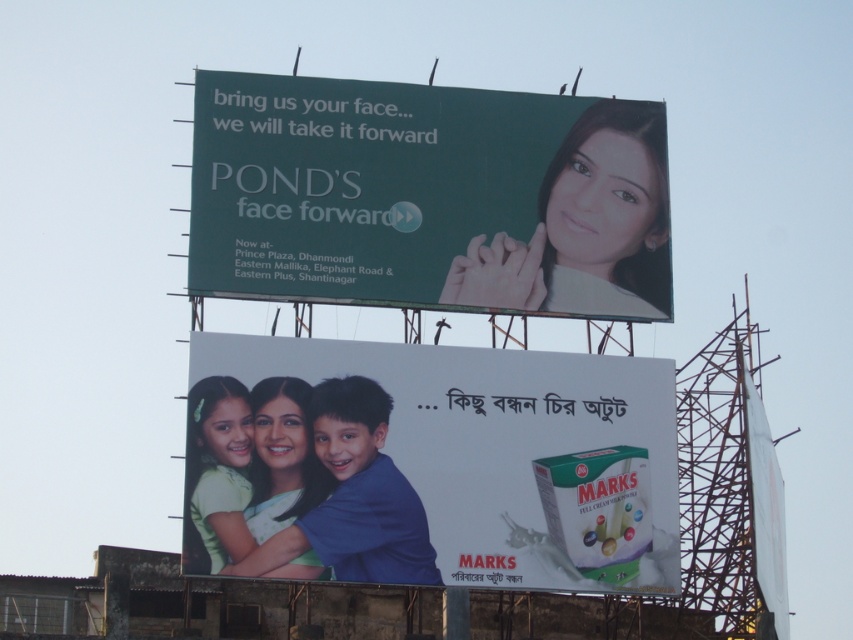
Between point (491, 272) and point (190, 499), which one is positioned behind?

The point (491, 272) is more distant.

Consider the image. Which is below, smooth skin face at upper right or matte white face at center?

Positioned lower is matte white face at center.

Find the location of a particular element. This screenshot has height=640, width=853. smooth skin face at upper right is located at coordinates (584, 227).

Does white cardboard box at center have a greater width compared to smooth skin face at upper right?

Yes, white cardboard box at center is wider than smooth skin face at upper right.

Which of these two, white cardboard box at center or smooth skin face at upper right, stands taller?

white cardboard box at center

Does point (395, 513) lie behind point (641, 131)?

No, it is in front of (641, 131).

The width and height of the screenshot is (853, 640). In order to click on white cardboard box at center in this screenshot , I will do `click(440, 464)`.

Does green matte billboard at upper center have a larger size compared to smooth skin face at upper right?

Yes, green matte billboard at upper center is bigger than smooth skin face at upper right.

Between green matte billboard at upper center and smooth skin face at upper right, which one is positioned higher?

green matte billboard at upper center

What do you see at coordinates (428, 196) in the screenshot?
I see `green matte billboard at upper center` at bounding box center [428, 196].

Find the location of `green matte billboard at upper center`. green matte billboard at upper center is located at coordinates (428, 196).